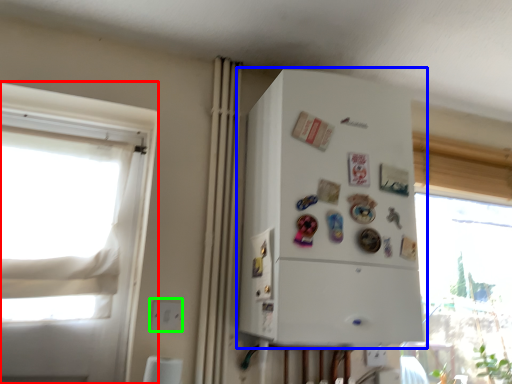
Question: Estimate the real-world distances between objects in this image. Which object is closer to window (highlighted by a red box), refrigerator (highlighted by a blue box) or electric outlet (highlighted by a green box)?

Choices:
 (A) refrigerator
 (B) electric outlet

Answer: (B)